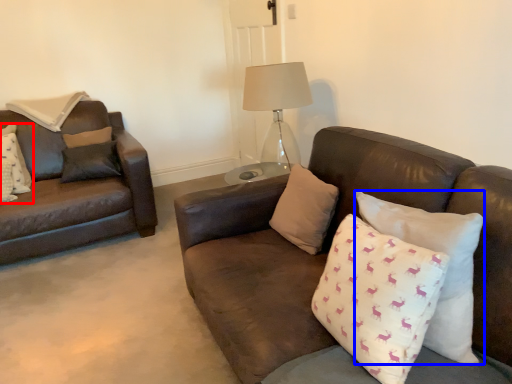
Question: Which object is closer to the camera taking this photo, pillow (highlighted by a red box) or pillow (highlighted by a blue box)?

Choices:
 (A) pillow
 (B) pillow

Answer: (B)